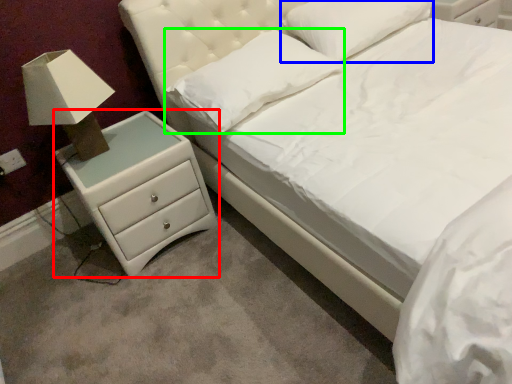
Question: Based on their relative distances, which object is nearer to chest of drawers (highlighted by a red box)? Choose from pillow (highlighted by a blue box) and pillow (highlighted by a green box).

Choices:
 (A) pillow
 (B) pillow

Answer: (B)